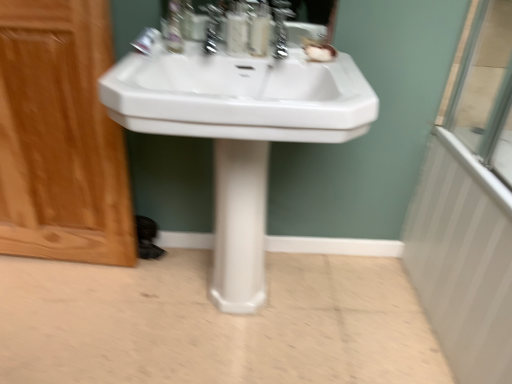
Image resolution: width=512 pixels, height=384 pixels. Identify the location of vacant area situated below white glossy sink at center (from a real-world perspective). (241, 313).